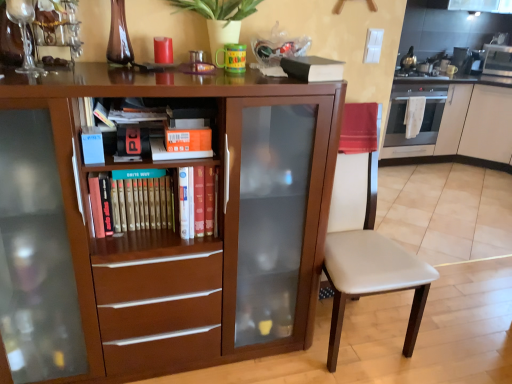
Question: Visually, is white leather chair at center positioned to the left or to the right of black matte book at upper center, placed as the 1th paperback book when sorted from right to left?

Choices:
 (A) right
 (B) left

Answer: (A)

Question: From the image's perspective, relative to black matte book at upper center, marked as the 1th paperback book in a top-to-bottom arrangement, is white leather chair at center above or below?

Choices:
 (A) below
 (B) above

Answer: (A)

Question: Based on their relative distances, which object is farther from the white leather chair at center?

Choices:
 (A) satin silver oven at right
 (B) orange matte paperback book at center, which is the third paperback book from top to bottom
 (C) green matte plant at upper center
 (D) hardcover book at center
 (E) orange matte bookshelf at center, the 2th paperback book from the top

Answer: (A)

Question: Based on their relative distances, which object is nearer to the white glossy cabinet at right, arranged as the 2th cabinetry when viewed from the left?

Choices:
 (A) green matte plant at upper center
 (B) orange matte paperback book at center, which ranks as the second paperback book in left-to-right order
 (C) metallic stainless steel microwave at upper right
 (D) orange matte bookshelf at center, the 2th paperback book from the top
 (E) white leather chair at center

Answer: (C)